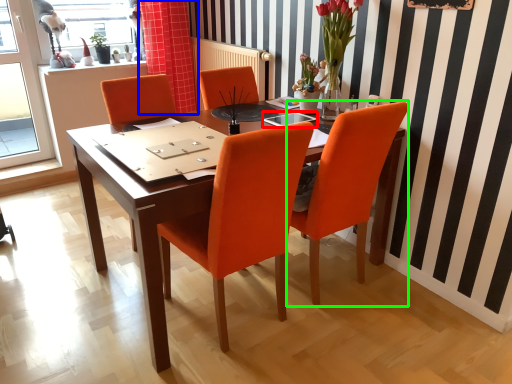
Question: Considering the real-world distances, which object is closest to glass table (highlighted by a red box)? curtain (highlighted by a blue box) or chair (highlighted by a green box).

Choices:
 (A) curtain
 (B) chair

Answer: (B)